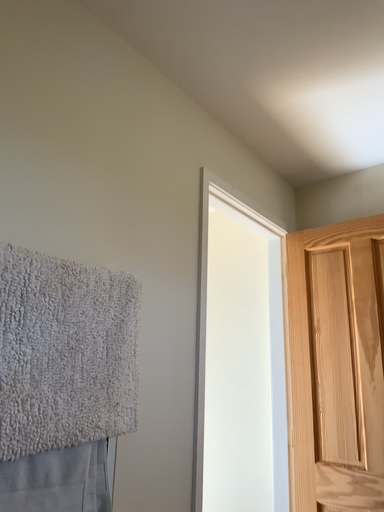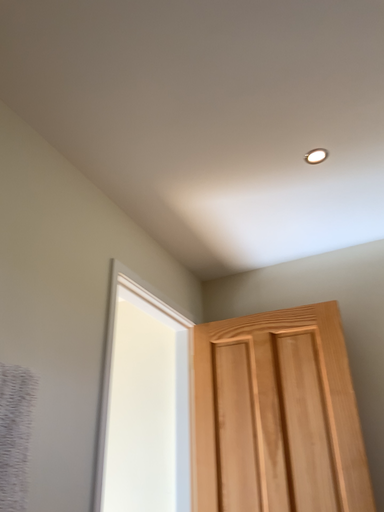
Question: How did the camera likely rotate when shooting the video?

Choices:
 (A) rotated right
 (B) rotated left

Answer: (A)